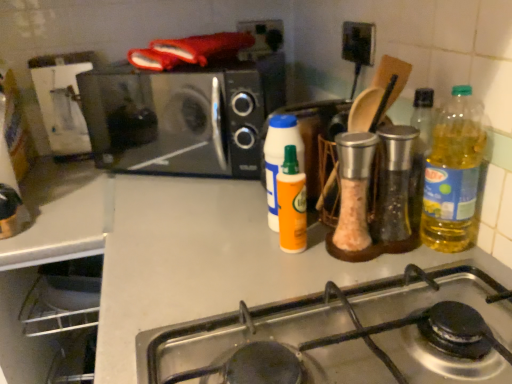
Find the location of a particular element. free spot in front of orange matte spray can at center, the 3th bottle when ordered from right to left is located at coordinates (285, 279).